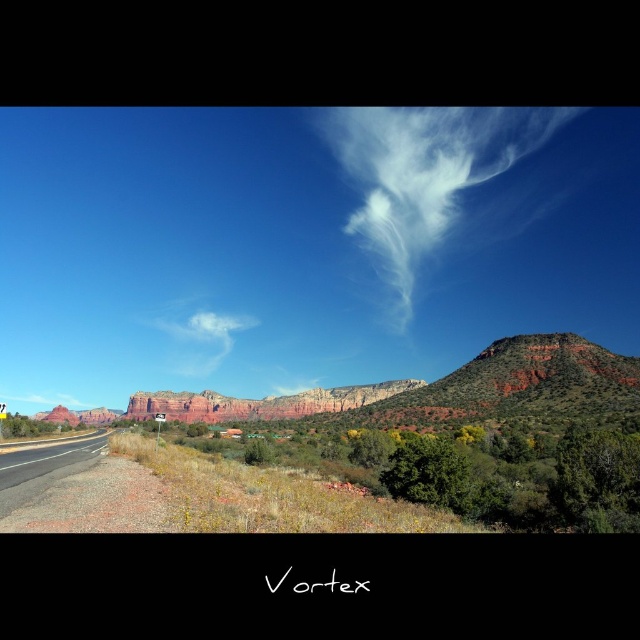
You are a photographer planning to capture the red rock formations in the background. You want to ensure the white cotton cloud at center is perfectly centered in your shot. Given its coordinates are at point 0.525, 0.311, is it already centered in the frame?

The white cotton cloud at center is already centered at point [198,336], so it is perfectly centered in the frame.

You are standing at the point closer to the camera between the two points, point (538, 125) and point (621, 381). Looking towards the red rock formations in the background, which direction should you turn to face the other point?

You should turn to your right to face point (621, 381) because it is further away from the camera compared to point (538, 125) which is closer.